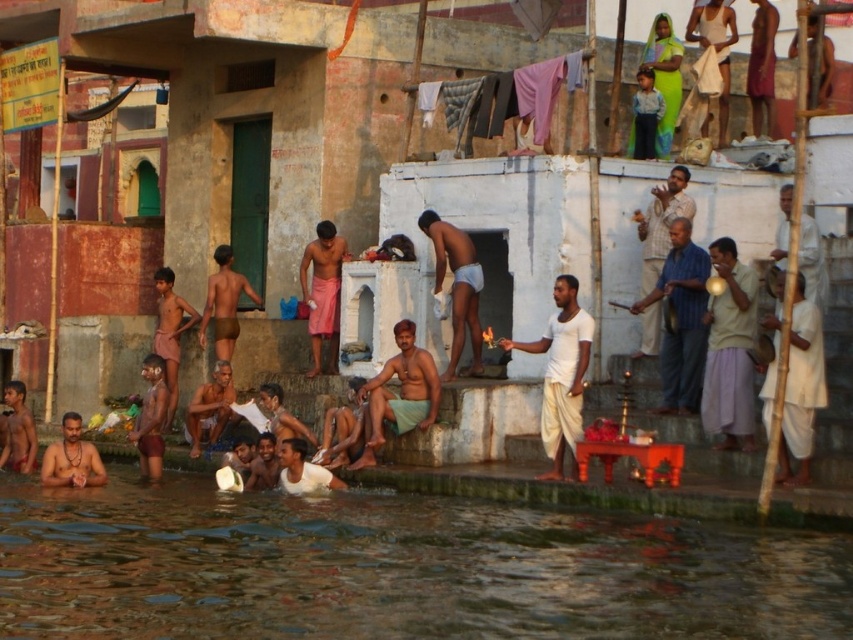
Question: Which of the following is the farthest from the observer?

Choices:
 (A) white cotton shirt at upper right
 (B) brown fabric shorts at center
 (C) brown skin boy at lower left
 (D) white cotton dhoti at lower center

Answer: (B)

Question: Which of the following is the closest to the observer?

Choices:
 (A) brown skin man at lower center
 (B) light yellow fabric at right
 (C) striped cotton shirt at right
 (D) green cotton cloth at center

Answer: (B)

Question: Estimate the real-world distances between objects in this image. Which object is closer to the brown skin man at lower center?

Choices:
 (A) pink cotton towel at center
 (B) skinny boy at lower left
 (C) white cotton shirt at upper right
 (D) light yellow fabric at right

Answer: (A)

Question: Can you confirm if light yellow fabric at right is wider than brown skin man at lower left?

Choices:
 (A) no
 (B) yes

Answer: (A)

Question: Is brown water at lower left in front of brown skin man at lower center?

Choices:
 (A) no
 (B) yes

Answer: (B)

Question: Does green cotton cloth at center have a greater width compared to brown skin boy at lower left?

Choices:
 (A) no
 (B) yes

Answer: (A)